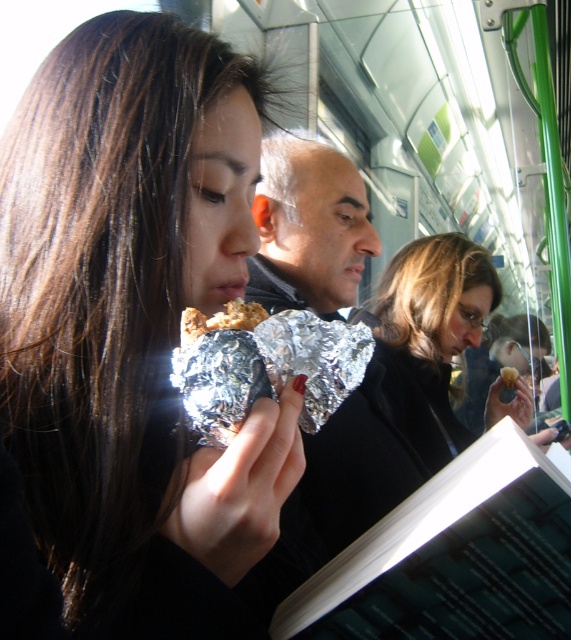
Question: Does shiny metallic food at center appear on the right side of silver foil wrapped food at center?

Choices:
 (A) no
 (B) yes

Answer: (A)

Question: Which point is closer to the camera taking this photo?

Choices:
 (A) (500, 372)
 (B) (195, 333)
 (C) (94, 620)

Answer: (C)

Question: Is matte black jacket at center to the left of shiny silver foil at center from the viewer's perspective?

Choices:
 (A) yes
 (B) no

Answer: (A)

Question: Based on their relative distances, which object is nearer to the matte black jacket at center?

Choices:
 (A) shiny silver foil at center
 (B) shiny metallic food at center

Answer: (A)

Question: Is matte black jacket at center positioned before shiny metallic sandwich at center?

Choices:
 (A) yes
 (B) no

Answer: (B)

Question: Among these objects, which one is farthest from the camera?

Choices:
 (A) shiny silver foil at center
 (B) shiny metallic food at center

Answer: (A)